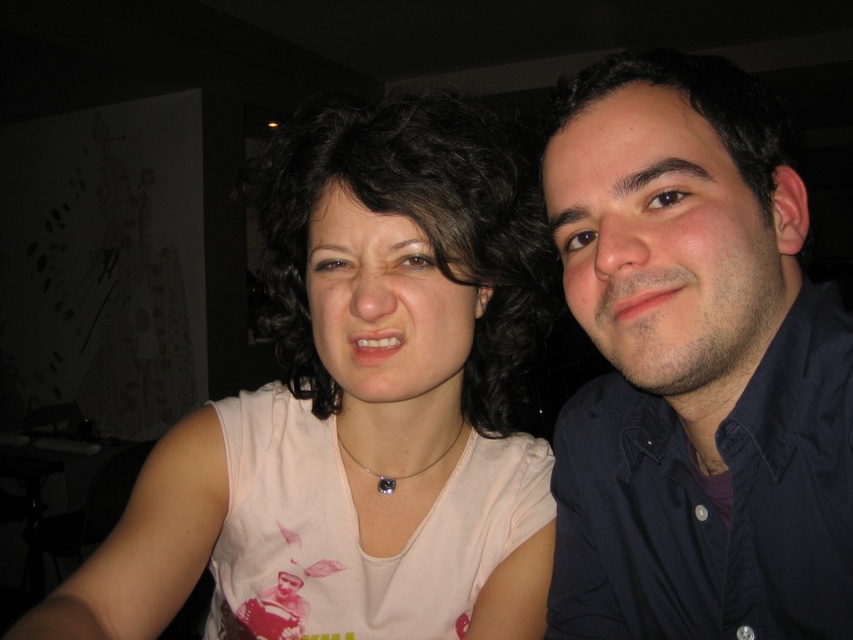
Question: Can you confirm if pink fabric shirt at center is positioned to the left of dark blue shirt at right?

Choices:
 (A) yes
 (B) no

Answer: (A)

Question: Is pink fabric shirt at center below dark blue shirt at right?

Choices:
 (A) no
 (B) yes

Answer: (A)

Question: Which point is closer to the camera?

Choices:
 (A) dark blue shirt at right
 (B) pink fabric shirt at center

Answer: (A)

Question: Which point is closer to the camera?

Choices:
 (A) (410, 388)
 (B) (822, 323)

Answer: (B)

Question: Does pink fabric shirt at center appear on the left side of dark blue shirt at right?

Choices:
 (A) yes
 (B) no

Answer: (A)